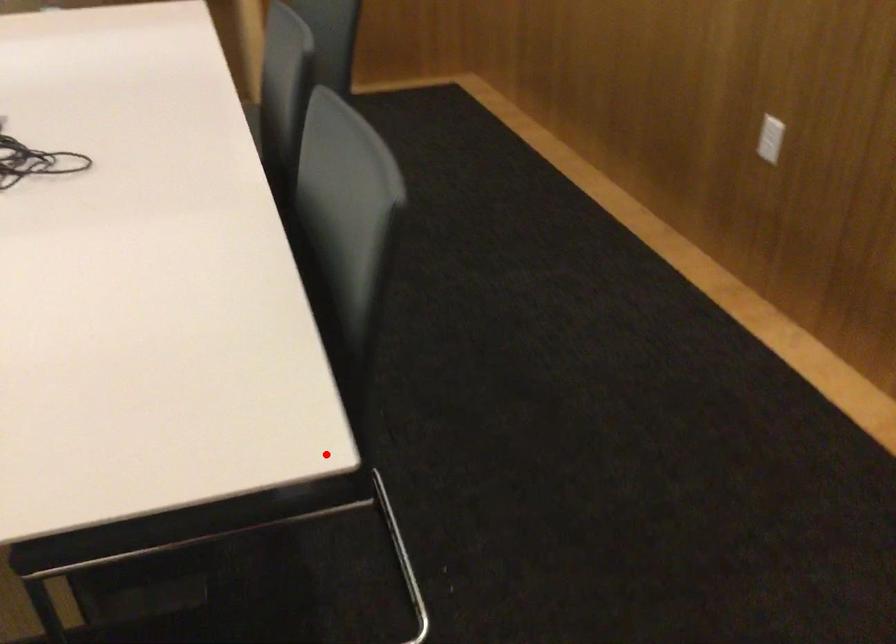
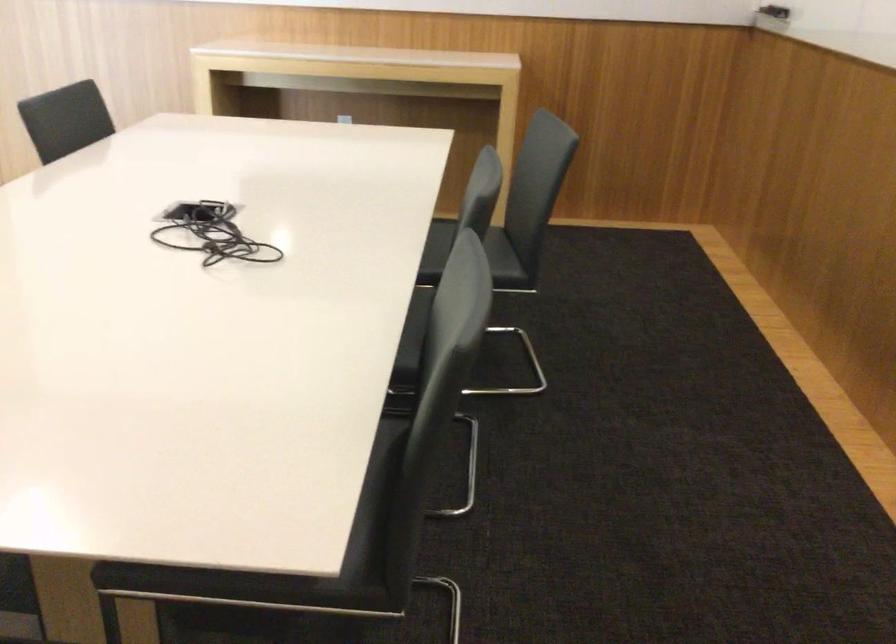
Question: A red point is marked in image1. In image2, is the corresponding 3D point closer to the camera or farther? Reply with the corresponding letter.

Choices:
 (A) The corresponding 3D point is closer.
 (B) The corresponding 3D point is farther.

Answer: (B)